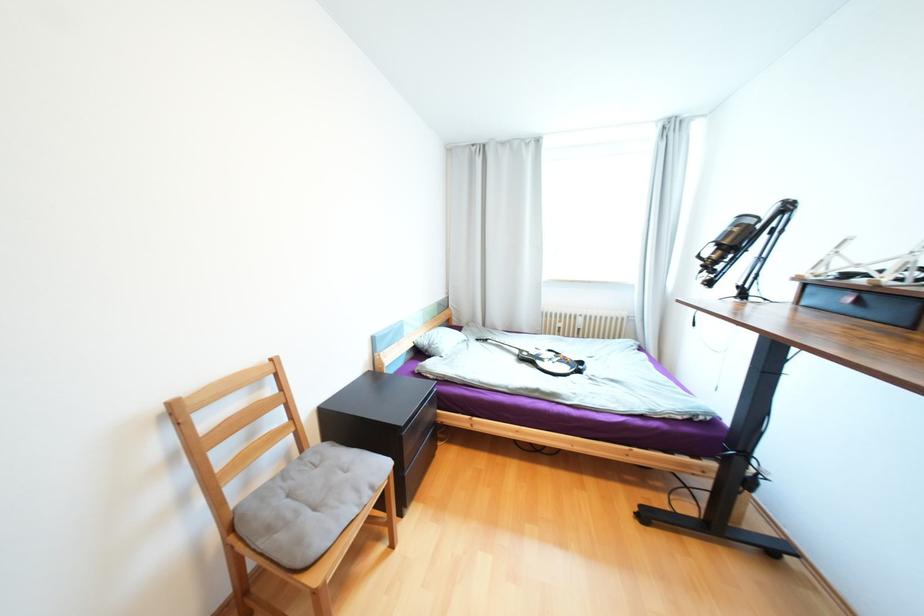
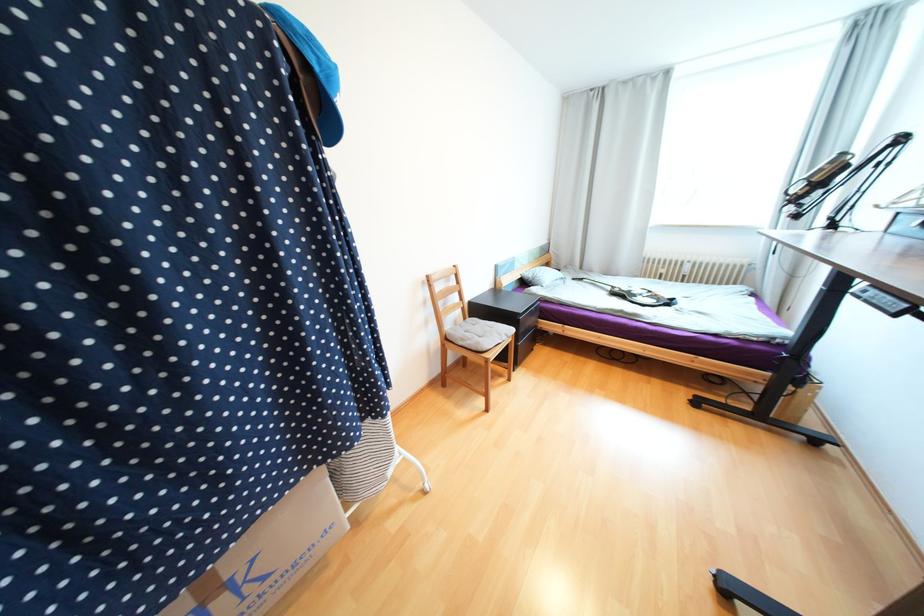
Find the pixel in the second image that matches [523,352] in the first image.

(614, 288)